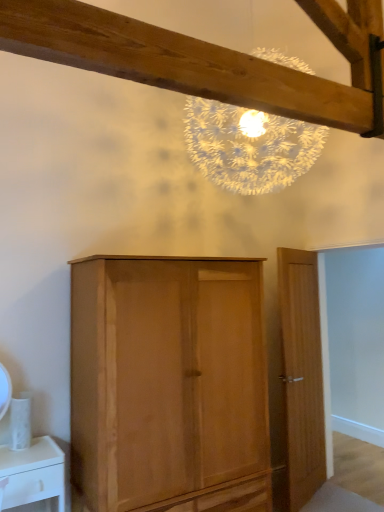
The height and width of the screenshot is (512, 384). I want to click on light brown wood cupboard at center, so click(169, 384).

Describe the element at coordinates (169, 384) in the screenshot. The height and width of the screenshot is (512, 384). I see `light brown wood cupboard at center` at that location.

Locate an element on the screen. light brown wooden door at right is located at coordinates (302, 374).

The image size is (384, 512). What do you see at coordinates (302, 374) in the screenshot?
I see `light brown wooden door at right` at bounding box center [302, 374].

This screenshot has width=384, height=512. Find the location of `light brown wood cupboard at center`. light brown wood cupboard at center is located at coordinates (169, 384).

Which object is positioned more to the left, light brown wood cupboard at center or light brown wooden door at right?

Positioned to the left is light brown wood cupboard at center.

Which object is closer to the camera taking this photo, light brown wood cupboard at center or light brown wooden door at right?

Positioned in front is light brown wood cupboard at center.

From the picture: Which is closer to the camera, (151, 377) or (288, 371)?

Point (151, 377)

From the image's perspective, which object appears higher, light brown wood cupboard at center or light brown wooden door at right?

From the image's view, light brown wooden door at right is above.

From a real-world perspective, is light brown wood cupboard at center on light brown wooden door at right?

Actually, light brown wood cupboard at center is physically below light brown wooden door at right in the real world.

Does light brown wood cupboard at center have a lesser width compared to light brown wooden door at right?

No.

Considering the sizes of objects light brown wood cupboard at center and light brown wooden door at right in the image provided, who is shorter, light brown wood cupboard at center or light brown wooden door at right?

light brown wood cupboard at center is shorter.

Between light brown wood cupboard at center and light brown wooden door at right, which one has larger size?

Bigger between the two is light brown wood cupboard at center.

Is light brown wooden door at right surrounded by light brown wood cupboard at center?

No.

From the picture: Is light brown wood cupboard at center far away from light brown wooden door at right?

They are positioned close to each other.

Is light brown wood cupboard at center oriented towards light brown wooden door at right?

No.

Can you tell me how much light brown wood cupboard at center and light brown wooden door at right differ in facing direction?

26.1 degrees.

The image size is (384, 512). I want to click on cupboard below the light brown wooden door at right (from the image's perspective), so click(x=169, y=384).

Does light brown wooden door at right appear on the left side of light brown wood cupboard at center?

No.

Based on the photo, which object is further away from the camera, light brown wooden door at right or light brown wood cupboard at center?

light brown wooden door at right.

Does point (314, 484) come behind point (131, 329)?

Yes.

From the image's perspective, is light brown wooden door at right positioned above or below light brown wood cupboard at center?

light brown wooden door at right is situated higher than light brown wood cupboard at center in the image.

From a real-world perspective, which is physically above, light brown wooden door at right or light brown wood cupboard at center?

light brown wooden door at right.

Based on the photo, between light brown wooden door at right and light brown wood cupboard at center, which one has smaller width?

light brown wooden door at right is thinner.

Which of these two, light brown wooden door at right or light brown wood cupboard at center, stands shorter?

light brown wood cupboard at center is shorter.

Considering the sizes of objects light brown wooden door at right and light brown wood cupboard at center in the image provided, who is bigger, light brown wooden door at right or light brown wood cupboard at center?

With larger size is light brown wood cupboard at center.

Would you say light brown wood cupboard at center is part of light brown wooden door at right's contents?

No.

Would you consider light brown wooden door at right to be distant from light brown wood cupboard at center?

light brown wooden door at right is near light brown wood cupboard at center, not far away.

Is light brown wooden door at right oriented away from light brown wood cupboard at center?

light brown wooden door at right is not turned away from light brown wood cupboard at center.

The height and width of the screenshot is (512, 384). In order to click on cupboard on the left side of light brown wooden door at right in this screenshot , I will do `click(169, 384)`.

At what (x,y) coordinates should I click in order to perform the action: click on door above the light brown wood cupboard at center (from a real-world perspective). Please return your answer as a coordinate pair (x, y). The height and width of the screenshot is (512, 384). Looking at the image, I should click on (302, 374).

Identify the location of cupboard below the light brown wooden door at right (from the image's perspective). (169, 384).